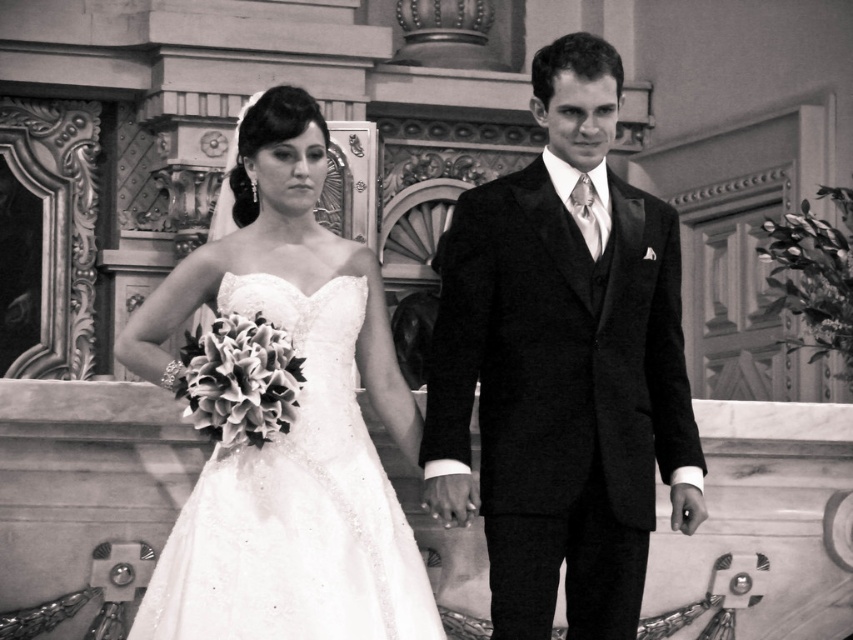
Is smooth black suit at center shorter than satin dress at center?

Incorrect, smooth black suit at center's height does not fall short of satin dress at center's.

Is point (619, 493) farther from viewer compared to point (314, 442)?

No, it is not.

You are a GUI agent. You are given a task and a screenshot of the screen. Output one action in this format:
    pyautogui.click(x=<x>, y=<y>)
    Task: Click on the smooth black suit at center
    
    Given the screenshot: What is the action you would take?
    coord(561,365)